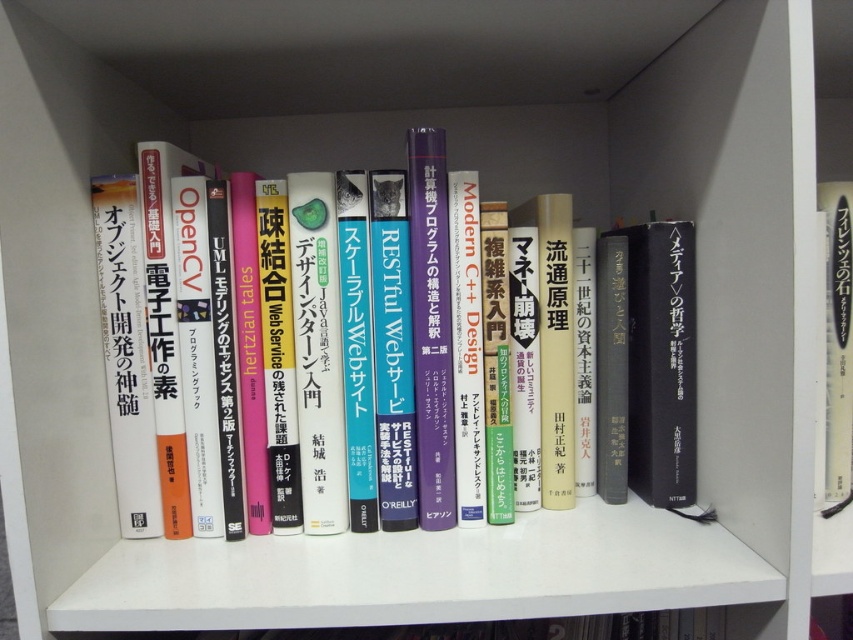
You are a librarian organizing books on a shelf. You need to place a new book exactly at the center of the shelf. The shelf has a coordinate system where the bottom left corner is the origin. Can you confirm if the point you marked at coordinates point (181, 353) is indeed the center of the shelf?

The point (181, 353) corresponds to the hardcover book at center, so yes, the marked point is indeed the center of the shelf.

You are organizing a bookshelf and need to place a new book between the hardcover book at center and the white paper book at right. Based on their current positions, where should the new book be placed?

The new book should be placed to the right of the hardcover book at center but to the left of the white paper book at right since the hardcover book at center is positioned on the left side of white paper book at right.

You are a librarian trying to place a new book on the shelf. The shelf has a coordinate system where the bottom left corner is the origin. The new book must be placed at the exact center of the shelf. Is the hardcover book at center currently occupying the exact center of the shelf?

The hardcover book at center is located at point (181, 353), which is close to the center but not exactly at the center point of the shelf. Therefore, the exact center is available for placing the new book.